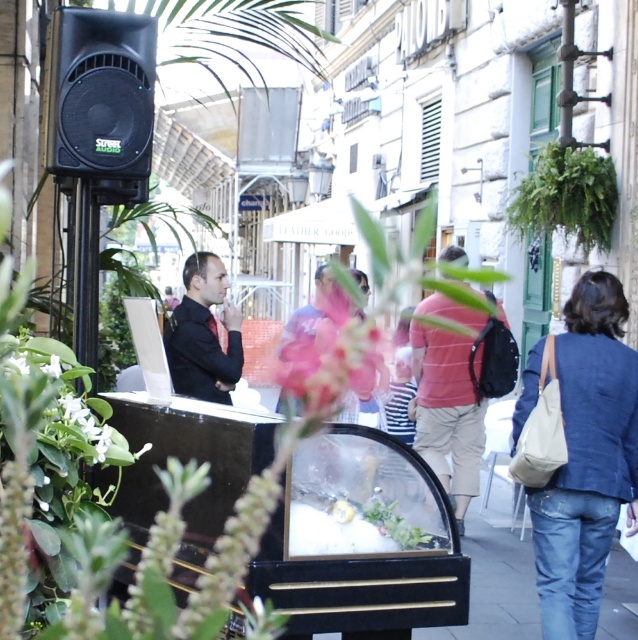
Is black smooth shirt at center to the right of white matte flower at center from the viewer's perspective?

Yes, black smooth shirt at center is to the right of white matte flower at center.

Can you confirm if black smooth shirt at center is thinner than white matte flower at center?

No, black smooth shirt at center is not thinner than white matte flower at center.

This screenshot has height=640, width=638. I want to click on black smooth shirt at center, so click(x=204, y=333).

Is black smooth shirt at center in front of pink matte flower at center?

Yes.

Does black smooth shirt at center appear under pink matte flower at center?

No.

I want to click on black smooth shirt at center, so click(204, 333).

Does point (452, 248) come closer to viewer compared to point (588, 252)?

Yes, it is.

Is point (447, 339) in front of point (604, 234)?

Yes, it is.

This screenshot has height=640, width=638. What are the coordinates of `red striped shirt at center` in the screenshot? It's located at (447, 412).